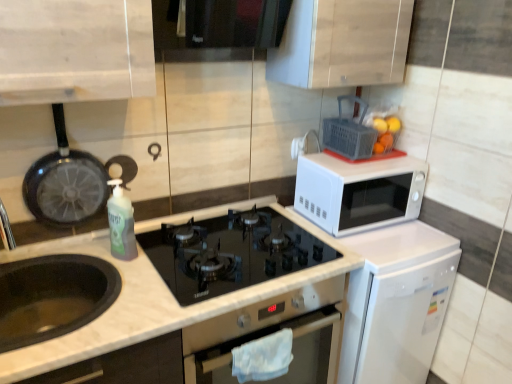
What are the coordinates of `free spot to the right of translucent plastic bottle at center-left` in the screenshot? It's located at (150, 261).